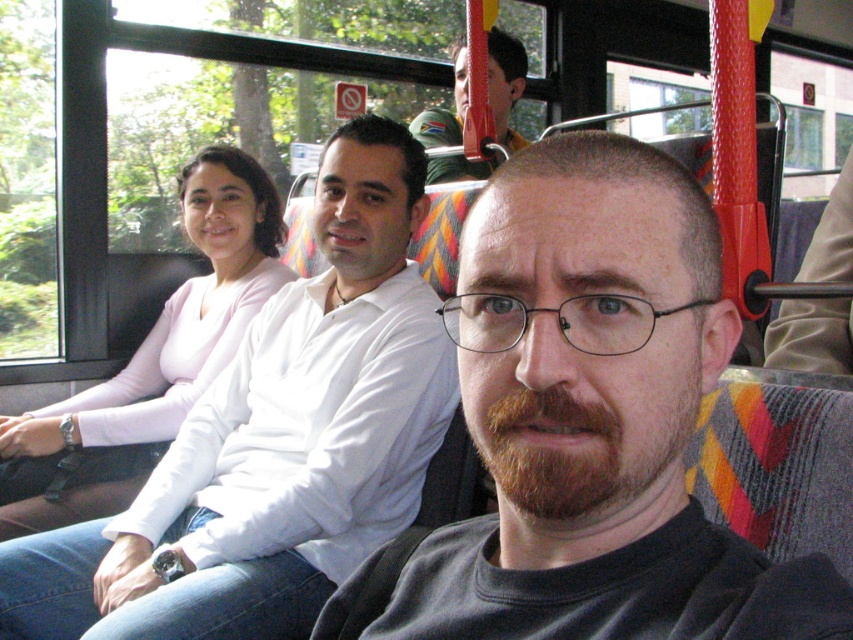
You are a passenger on the bus looking at the scene. You notice the pink matte sweater at upper left and the green fabric cap at upper center. Which object is positioned more to the left side of the bus?

The pink matte sweater at upper left is positioned more to the left side of the bus than the green fabric cap at upper center.

Consider the image. You are standing at the point marked as point (570, 493) in the bus scene. If you want to wave to someone who is exactly 18.20 inches away from you, which direction should you face?

You should face the direction of the viewer since the point (570, 493) is 18.20 inches away from the viewer.

Based on the scene description, where is the dark gray shirt at center located in the image?

The dark gray shirt at center is located at point 0.666 on the x axis and 0.689 on the y axis.